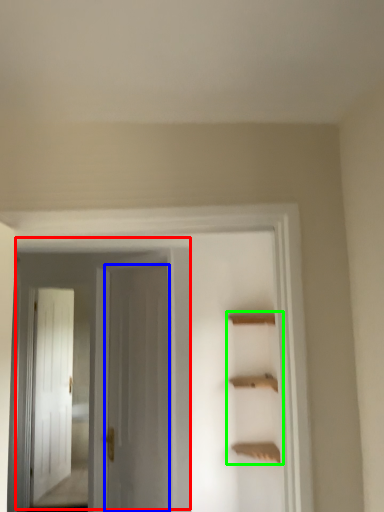
Question: Which object is the closest to the door (highlighted by a red box)? Choose among these: door (highlighted by a blue box) or cabinet (highlighted by a green box).

Choices:
 (A) door
 (B) cabinet

Answer: (A)